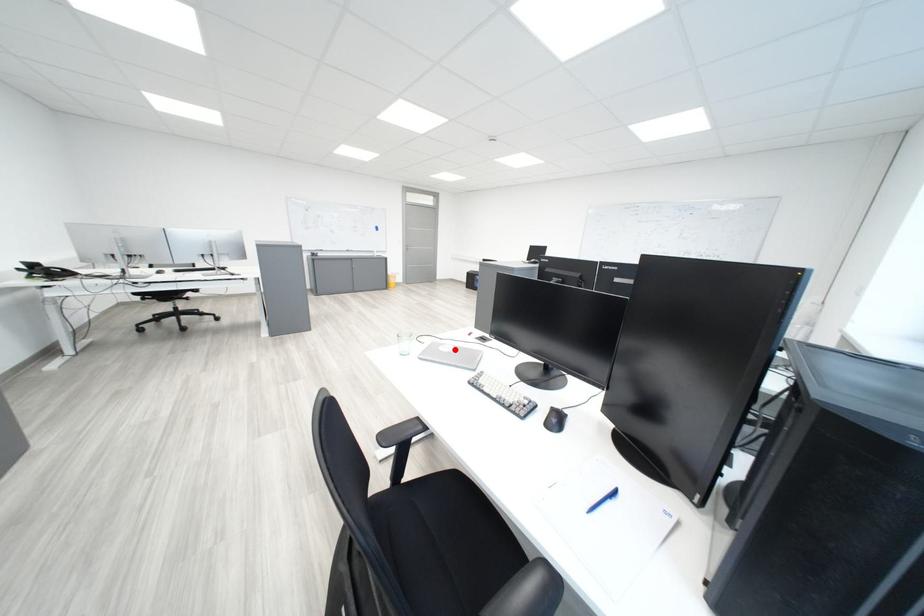
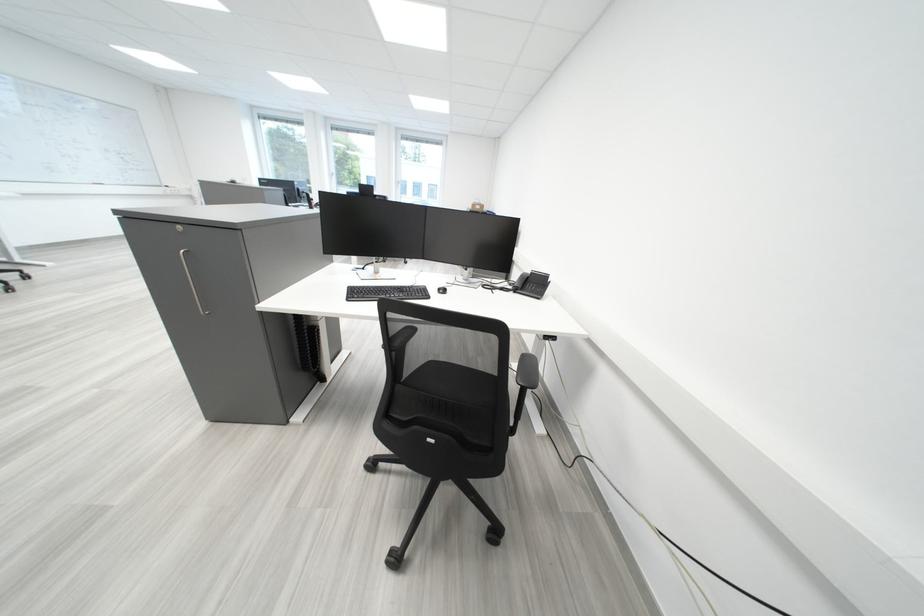
Question: I am providing you with two images of the same scene from different viewpoints. A red point is marked on the first image. Is the red point's position out of view in image 2?

Choices:
 (A) Yes
 (B) No

Answer: (A)